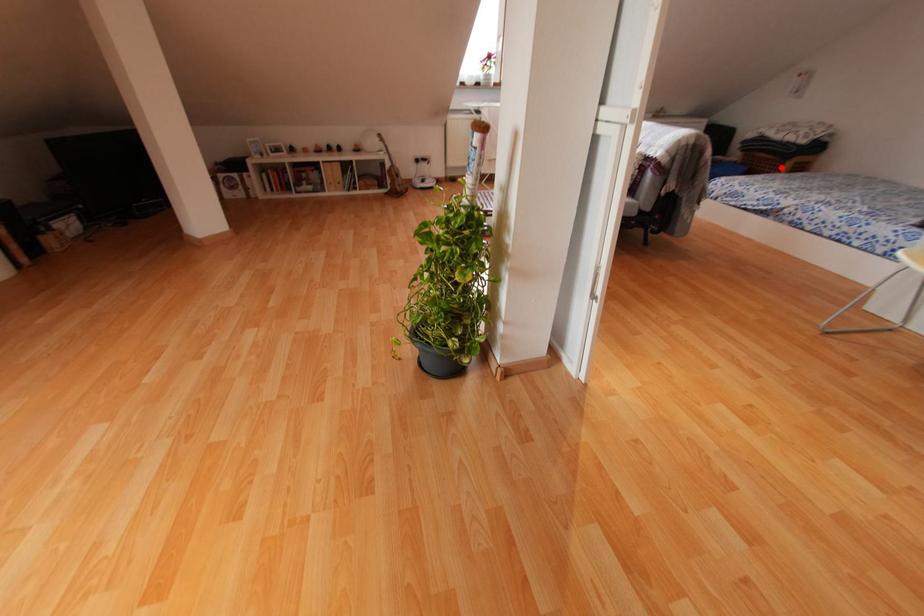
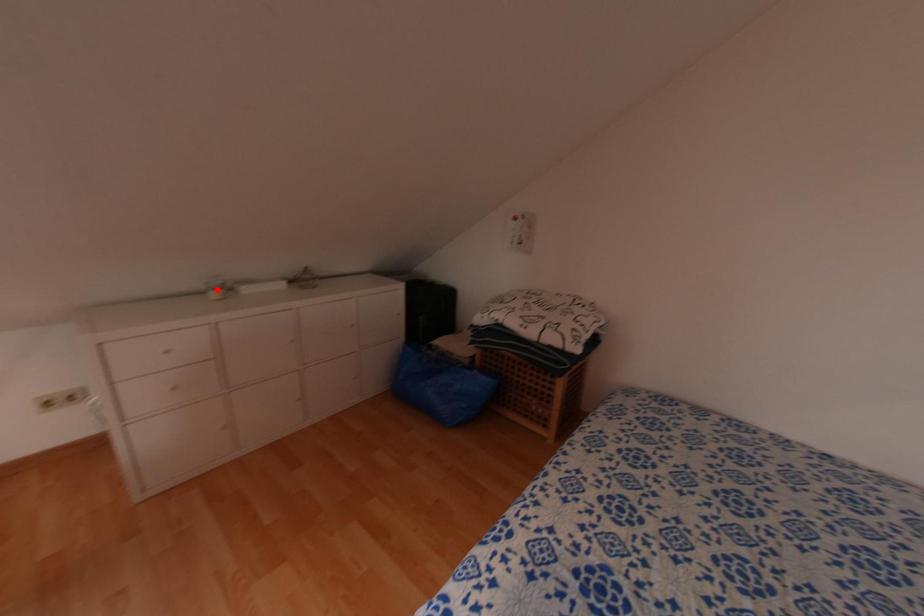
Consider the image. I am providing you with two images of the same scene from different viewpoints. A red point is marked on the first image and another point is marked on the second image. Are the points marked in image1 and image2 representing the same 3D position?

No